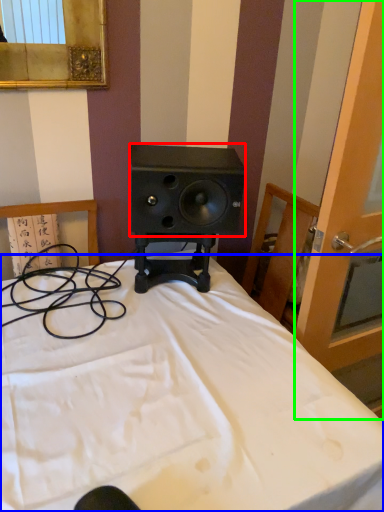
Question: Which is nearer to the speaker (highlighted by a red box)? bed (highlighted by a blue box) or screen door (highlighted by a green box).

Choices:
 (A) bed
 (B) screen door

Answer: (B)